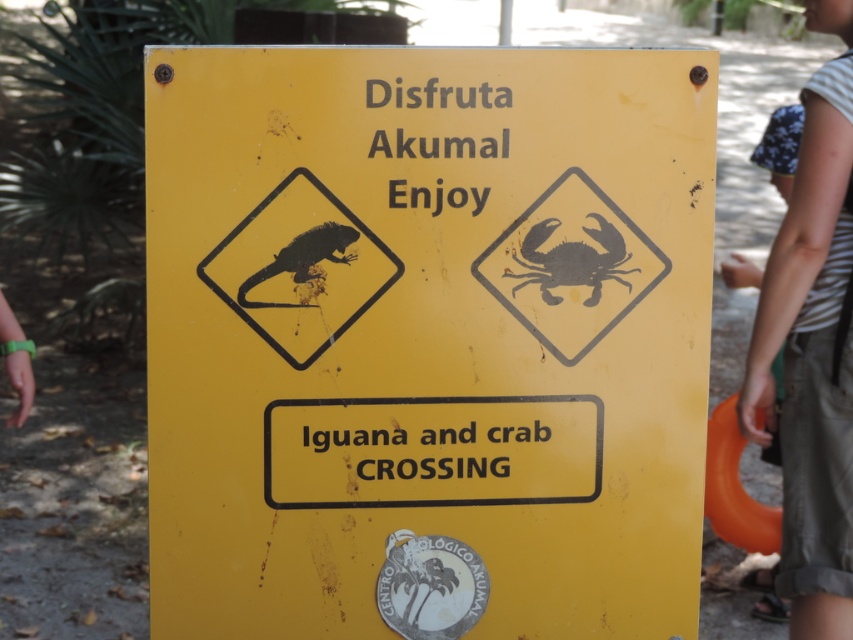
You are a photographer trying to capture the entire sign in your photo. You notice two points on the sign at coordinates point (544,280) and point (299,305). Which point is closer to the camera?

Point (299,305) is closer to the camera than point (544,280).

Consider the image. You are a tourist walking towards the yellow matte sign at center and the black matte crab at upper right. Which object will you see first as you approach?

You will see the yellow matte sign at center first because it is closer to you than the black matte crab at upper right, which is further away.